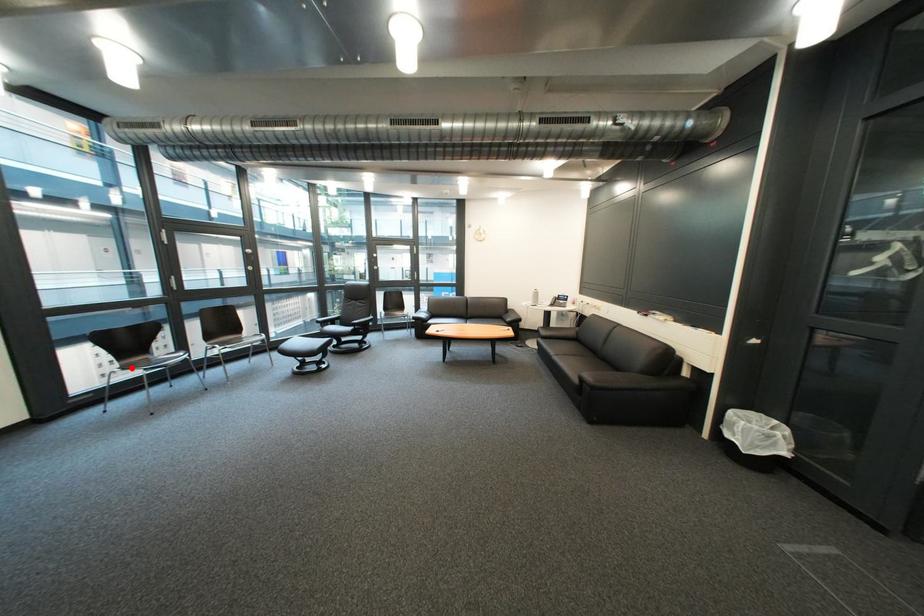
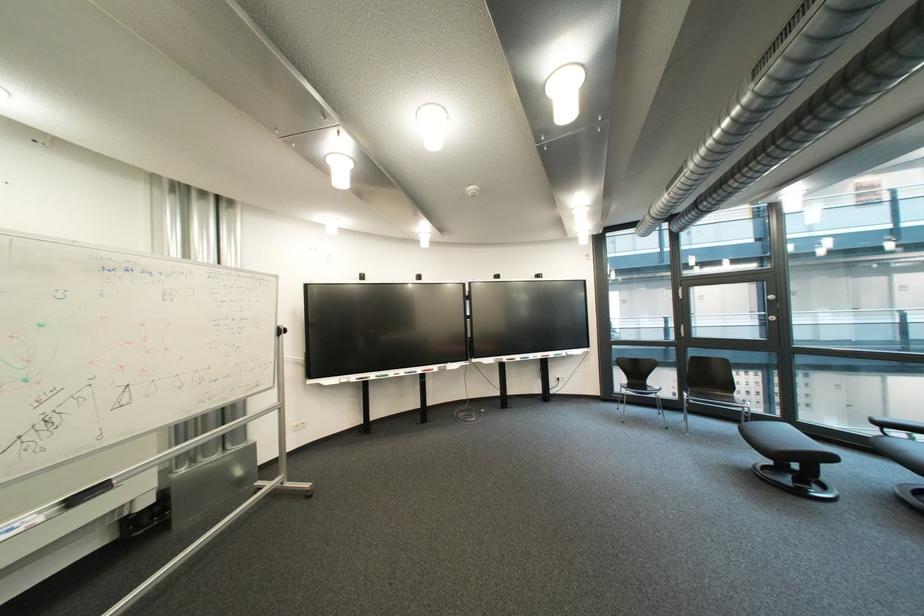
Question: I am providing you with two images of the same scene from different viewpoints. Image1 has a red point marked. In image2, the corresponding 3D location appears at what relative position? Reply with the corresponding letter.

Choices:
 (A) Closer
 (B) Farther

Answer: (B)